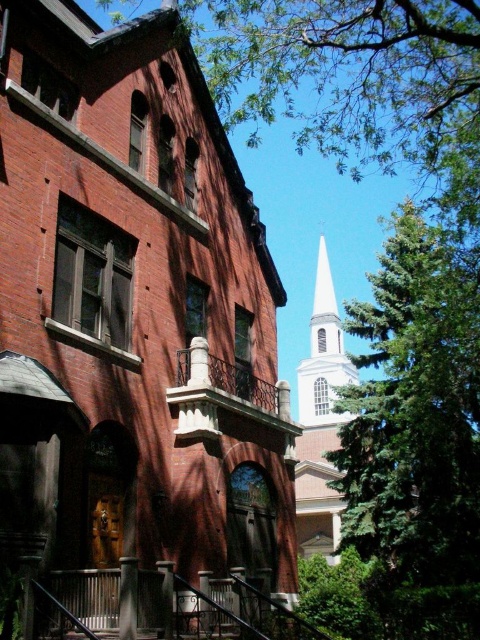
Question: Which of the following is the closest to the observer?

Choices:
 (A) white smooth steeple at upper center
 (B) green leafy tree at right

Answer: (A)

Question: Can you confirm if green leafy tree at upper center is wider than green leafy tree at right?

Choices:
 (A) no
 (B) yes

Answer: (B)

Question: Does white steeple at upper center appear under white smooth steeple at upper right?

Choices:
 (A) yes
 (B) no

Answer: (B)

Question: Considering the real-world distances, which object is farthest from the white steeple at upper center?

Choices:
 (A) white smooth steeple at upper right
 (B) green leafy tree at upper center
 (C) white smooth steeple at upper center
 (D) green leafy tree at right

Answer: (A)

Question: Is the position of green leafy tree at upper center more distant than that of white smooth steeple at upper right?

Choices:
 (A) no
 (B) yes

Answer: (A)

Question: Estimate the real-world distances between objects in this image. Which object is closer to the white smooth steeple at upper center?

Choices:
 (A) green leafy tree at right
 (B) white smooth steeple at upper right
 (C) green leafy tree at upper center
 (D) white steeple at upper center

Answer: (B)